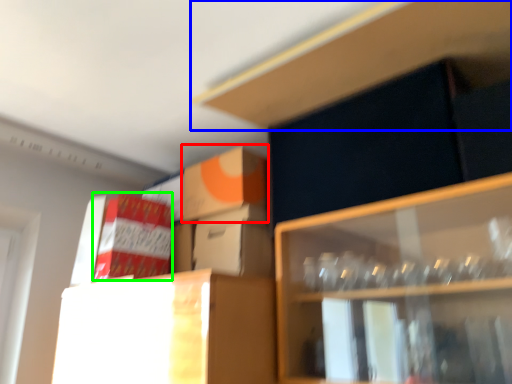
Question: Which is farther away from cardboard box (highlighted by a red box)? cabinet (highlighted by a blue box) or cardboard box (highlighted by a green box)?

Choices:
 (A) cabinet
 (B) cardboard box

Answer: (A)